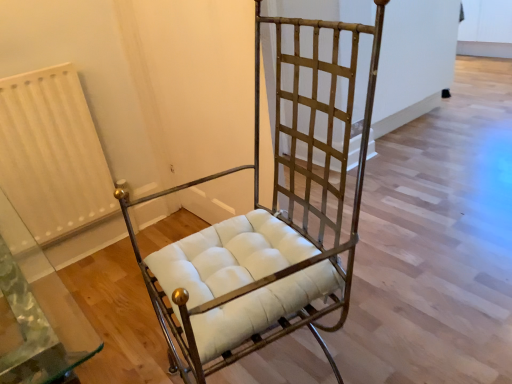
Question: Can white textured radiator at left be found inside gold metal chair at center?

Choices:
 (A) yes
 (B) no

Answer: (B)

Question: From the image's perspective, would you say gold metal chair at center is positioned over white textured radiator at left?

Choices:
 (A) yes
 (B) no

Answer: (B)

Question: Is gold metal chair at center located outside white textured radiator at left?

Choices:
 (A) no
 (B) yes

Answer: (B)

Question: Is gold metal chair at center taller than white textured radiator at left?

Choices:
 (A) no
 (B) yes

Answer: (B)

Question: Is gold metal chair at center aimed at white textured radiator at left?

Choices:
 (A) no
 (B) yes

Answer: (A)

Question: Is gold metal chair at center to the right of white textured radiator at left from the viewer's perspective?

Choices:
 (A) no
 (B) yes

Answer: (B)

Question: Is white textured radiator at left behind gold metal chair at center?

Choices:
 (A) no
 (B) yes

Answer: (B)

Question: Is white textured radiator at left far away from gold metal chair at center?

Choices:
 (A) yes
 (B) no

Answer: (B)

Question: Is white textured radiator at left positioned in front of gold metal chair at center?

Choices:
 (A) yes
 (B) no

Answer: (B)

Question: Is white textured radiator at left next to gold metal chair at center?

Choices:
 (A) no
 (B) yes

Answer: (A)

Question: Is white textured radiator at left located outside gold metal chair at center?

Choices:
 (A) yes
 (B) no

Answer: (A)

Question: From the image's perspective, is white textured radiator at left beneath gold metal chair at center?

Choices:
 (A) no
 (B) yes

Answer: (A)

Question: Considering their positions, is white textured radiator at left located in front of or behind gold metal chair at center?

Choices:
 (A) behind
 (B) front

Answer: (A)